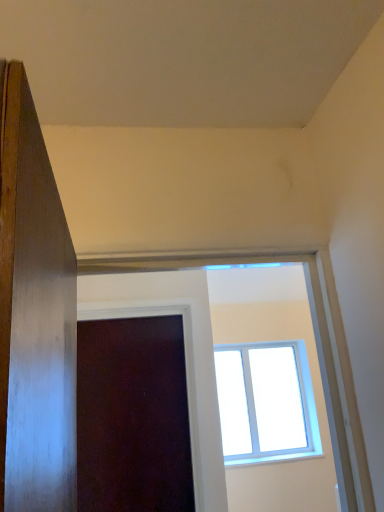
Describe the element at coordinates (266, 402) in the screenshot. The width and height of the screenshot is (384, 512). I see `transparent glass window at upper center` at that location.

At what (x,y) coordinates should I click in order to perform the action: click on transparent glass window at upper center. Please return your answer as a coordinate pair (x, y). This screenshot has width=384, height=512. Looking at the image, I should click on (266, 402).

Find the location of a particular element. This screenshot has height=512, width=384. transparent glass window at upper center is located at coordinates (266, 402).